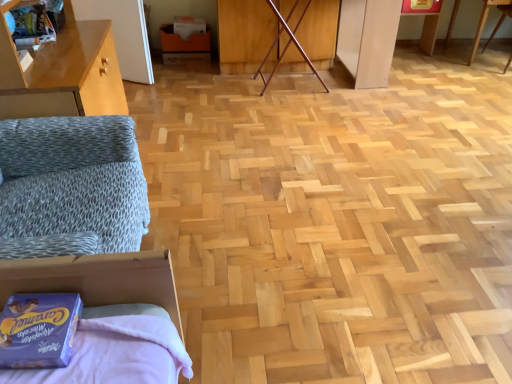
Question: From a real-world perspective, is matte cardboard box at center physically below blue cardboard box at lower left?

Choices:
 (A) yes
 (B) no

Answer: (A)

Question: Does matte cardboard box at center come behind blue cardboard box at lower left?

Choices:
 (A) yes
 (B) no

Answer: (A)

Question: Does matte cardboard box at center have a greater width compared to blue cardboard box at lower left?

Choices:
 (A) no
 (B) yes

Answer: (B)

Question: Is matte cardboard box at center with blue cardboard box at lower left?

Choices:
 (A) no
 (B) yes

Answer: (A)

Question: Considering the relative sizes of matte cardboard box at center and blue cardboard box at lower left in the image provided, is matte cardboard box at center bigger than blue cardboard box at lower left?

Choices:
 (A) no
 (B) yes

Answer: (B)

Question: Is blue cardboard box at lower left at the back of matte cardboard box at center?

Choices:
 (A) yes
 (B) no

Answer: (B)

Question: Can you confirm if wooden table at upper right is wider than blue cardboard box at lower left?

Choices:
 (A) no
 (B) yes

Answer: (B)

Question: Could blue cardboard box at lower left be considered to be inside wooden table at upper right?

Choices:
 (A) yes
 (B) no

Answer: (B)

Question: Is wooden table at upper right shorter than blue cardboard box at lower left?

Choices:
 (A) no
 (B) yes

Answer: (A)

Question: From the image's perspective, would you say wooden table at upper right is positioned over blue cardboard box at lower left?

Choices:
 (A) no
 (B) yes

Answer: (B)

Question: Is wooden table at upper right with blue cardboard box at lower left?

Choices:
 (A) yes
 (B) no

Answer: (B)

Question: Does wooden table at upper right lie behind blue cardboard box at lower left?

Choices:
 (A) no
 (B) yes

Answer: (B)

Question: Is wooden table at upper right to the right of matte cardboard box at center from the viewer's perspective?

Choices:
 (A) no
 (B) yes

Answer: (B)